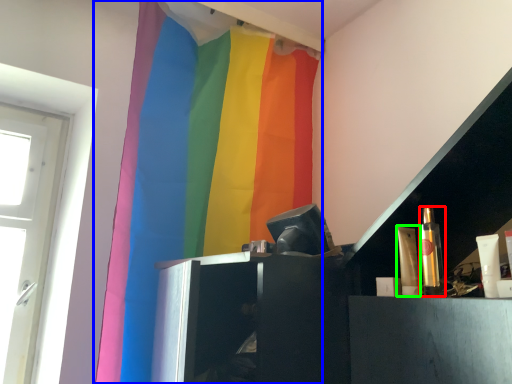
Question: Which object is the farthest from toiletry (highlighted by a red box)? Choose among these: curtain (highlighted by a blue box) or toiletry (highlighted by a green box).

Choices:
 (A) curtain
 (B) toiletry

Answer: (A)